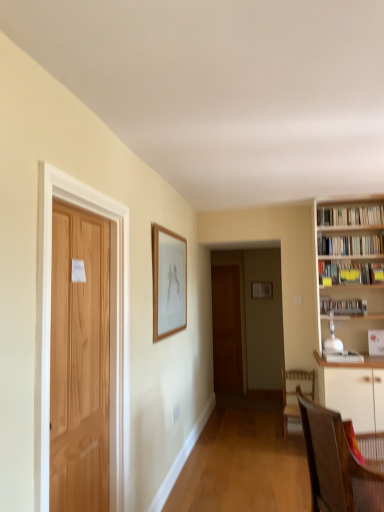
Question: From the image's perspective, is wooden picture frame at upper center, the 1th picture frame when ordered from front to back, on natural wood door at left, the first door from the left?

Choices:
 (A) no
 (B) yes

Answer: (B)

Question: Could you tell me if wooden picture frame at upper center, the first picture frame when ordered from left to right, is turned towards natural wood door at left, which ranks as the first door in front-to-back order?

Choices:
 (A) no
 (B) yes

Answer: (A)

Question: Does wooden picture frame at upper center, the first picture frame when ordered from left to right, have a lesser width compared to natural wood door at left, the first door from the left?

Choices:
 (A) yes
 (B) no

Answer: (A)

Question: Can you confirm if wooden picture frame at upper center, the 1th picture frame when ordered from front to back, is wider than natural wood door at left, marked as the second door in a right-to-left arrangement?

Choices:
 (A) yes
 (B) no

Answer: (B)

Question: Does wooden picture frame at upper center, which is the second picture frame from back to front, appear on the right side of natural wood door at left, which ranks as the first door in front-to-back order?

Choices:
 (A) no
 (B) yes

Answer: (B)

Question: From a real-world perspective, does wooden picture frame at upper center, the first picture frame when ordered from left to right, stand above natural wood door at left, which is counted as the second door, starting from the back?

Choices:
 (A) yes
 (B) no

Answer: (A)

Question: Is white glossy bookshelf at right, which ranks as the second book in top-to-bottom order, oriented away from yellow paper at upper right, the 2th book ordered from the bottom?

Choices:
 (A) no
 (B) yes

Answer: (A)

Question: Does white glossy bookshelf at right, which ranks as the second book in top-to-bottom order, have a greater height compared to yellow paper at upper right, positioned as the third book in top-to-bottom order?

Choices:
 (A) yes
 (B) no

Answer: (B)

Question: Does white glossy bookshelf at right, placed as the 3th book when sorted from bottom to top, have a larger size compared to yellow paper at upper right, the 2th book ordered from the bottom?

Choices:
 (A) yes
 (B) no

Answer: (A)

Question: Can you confirm if white glossy bookshelf at right, placed as the 3th book when sorted from bottom to top, is positioned to the right of yellow paper at upper right, positioned as the third book in top-to-bottom order?

Choices:
 (A) no
 (B) yes

Answer: (B)

Question: Can you confirm if white glossy bookshelf at right, placed as the 3th book when sorted from bottom to top, is positioned to the left of yellow paper at upper right, positioned as the third book in top-to-bottom order?

Choices:
 (A) no
 (B) yes

Answer: (A)

Question: From a real-world perspective, does white glossy bookshelf at right, placed as the 3th book when sorted from bottom to top, stand above yellow paper at upper right, positioned as the third book in top-to-bottom order?

Choices:
 (A) yes
 (B) no

Answer: (A)

Question: Can you confirm if yellow paper at upper right, the 2th book ordered from the bottom, is smaller than brown woven chair at lower right, the first chair viewed from the front?

Choices:
 (A) yes
 (B) no

Answer: (A)